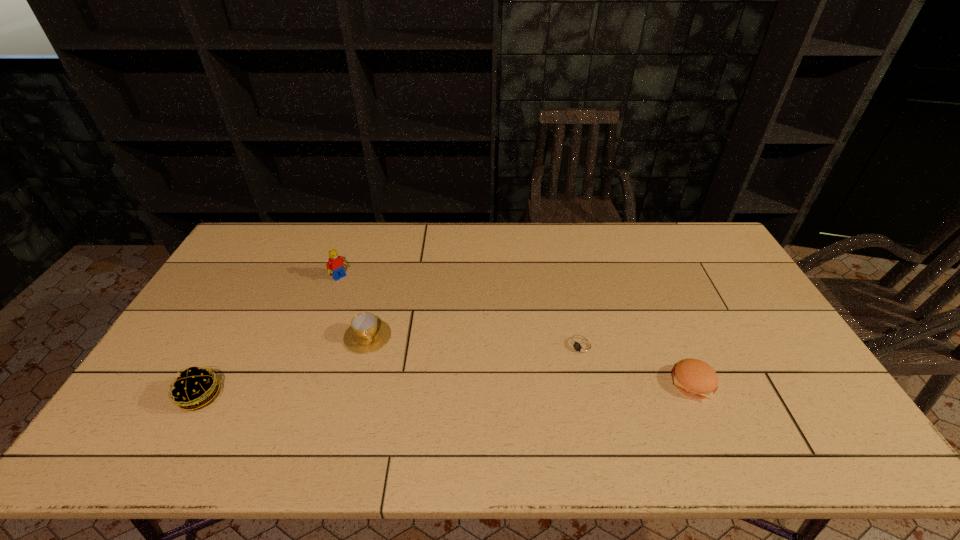
Where is `object that is at the left edge`? Image resolution: width=960 pixels, height=540 pixels. object that is at the left edge is located at coordinates click(194, 388).

Identify the location of object positioned at the near left corner. Image resolution: width=960 pixels, height=540 pixels. (194, 388).

Identify the location of blank space at the far edge of the desktop. This screenshot has height=540, width=960. (475, 246).

In the image, there is a desktop. At what (x,y) coordinates should I click in order to perform the action: click on vacant space at the near edge. Please return your answer as a coordinate pair (x, y). This screenshot has height=540, width=960. Looking at the image, I should click on click(x=348, y=417).

Where is `vacant space at the left edge`? vacant space at the left edge is located at coordinates (216, 282).

Identify the location of free location at the right edge of the desktop. The height and width of the screenshot is (540, 960). (744, 349).

In the image, there is a desktop. In order to click on blank space at the far right corner in this screenshot , I will do `click(675, 245)`.

What are the coordinates of `free spot between the second object from right to left and the fourth object from right to left` in the screenshot? It's located at (461, 312).

At what (x,y) coordinates should I click in order to perform the action: click on free space between the third object from right to left and the Lego. Please return your answer as a coordinate pair (x, y). Looking at the image, I should click on (353, 307).

The height and width of the screenshot is (540, 960). I want to click on empty location between the third object from right to left and the second object from right to left, so click(475, 342).